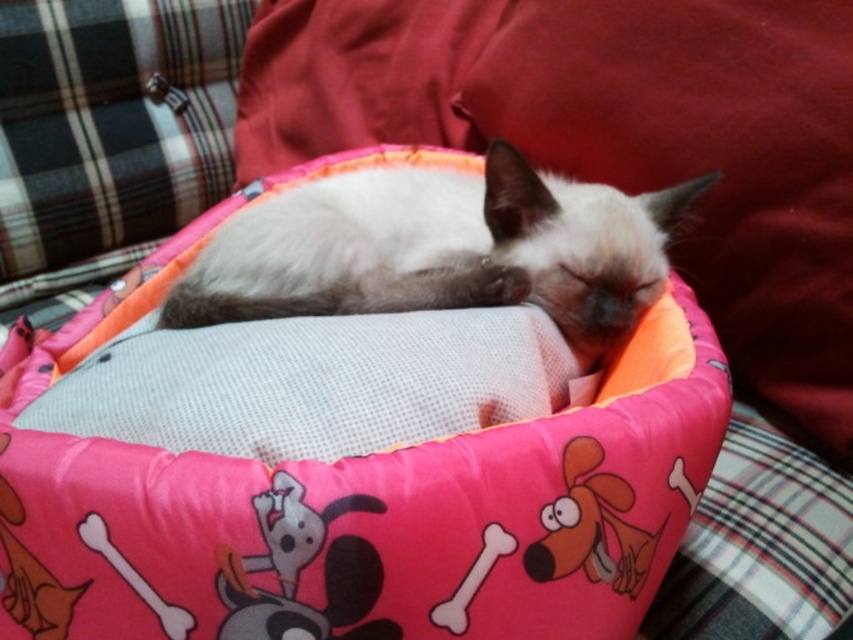
You are trying to place a small toy for the cat near the pink fabric bean bag chair at center. According to the coordinates provided, where should you place the toy relative to the bean bag chair?

The pink fabric bean bag chair at center is located at point (358, 506), so you should place the toy near those coordinates to ensure it is close to the bean bag chair.

You are a guest in this home and want to pet the silky white cat at center without disturbing it. Since the cat is on the pink fabric bean bag chair at center, where should you approach from?

The pink fabric bean bag chair at center is located below the silky white cat at center, so you should approach from the sides or the front to avoid startling the cat.